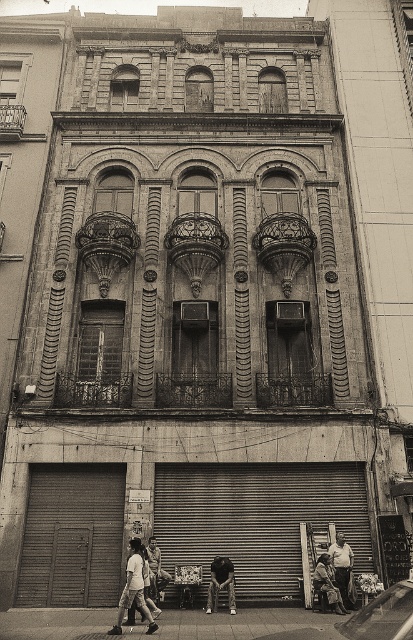
Question: Does white cotton shirt at lower center lie behind light brown leather jacket at lower center?

Choices:
 (A) yes
 (B) no

Answer: (B)

Question: Observing the image, what is the correct spatial positioning of light brown leather jacket at lower center in reference to dark gray fabric pants at lower center?

Choices:
 (A) left
 (B) right

Answer: (B)

Question: Which of these objects is positioned closest to the white cotton shirt at lower center?

Choices:
 (A) wooden shuttered garage door at lower left
 (B) dark brown leather jacket at center
 (C) dark gray fabric pants at lower center
 (D) wooden stool at lower center

Answer: (D)

Question: Which of the following is the closest to the observer?

Choices:
 (A) dark gray fabric pants at lower center
 (B) white cotton shirt at lower center

Answer: (B)

Question: Is white cotton shirt at lower center to the right of light brown leather jacket at lower center from the viewer's perspective?

Choices:
 (A) yes
 (B) no

Answer: (B)

Question: Which object appears farthest from the camera in this image?

Choices:
 (A) metallic gray garage door at center
 (B) dark brown leather jacket at center

Answer: (A)